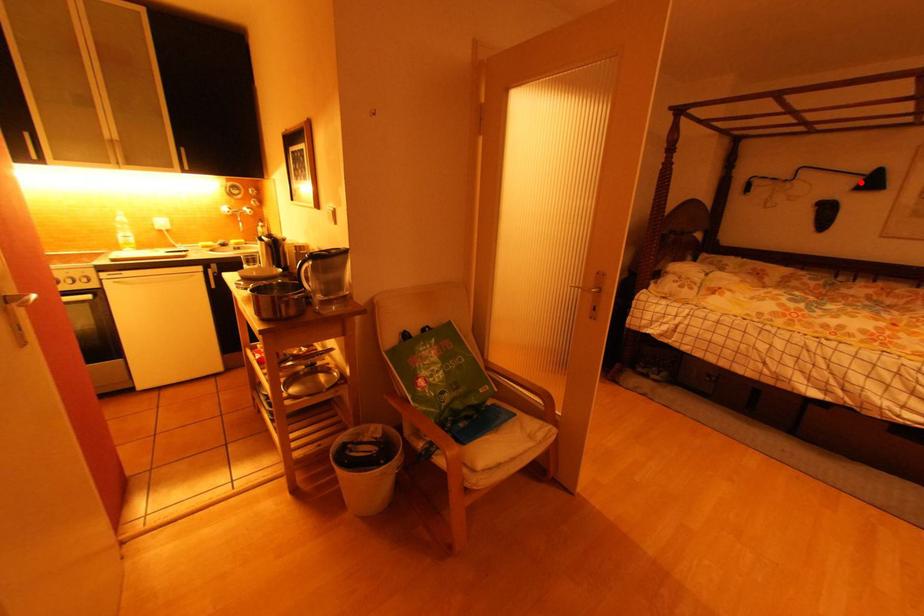
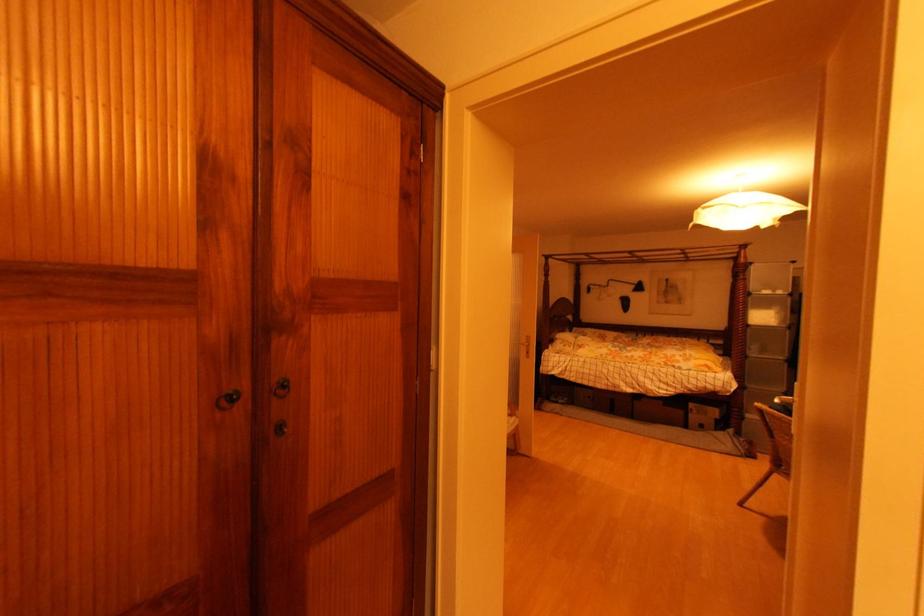
Question: I am providing you with two images of the same scene from different viewpoints. Given a red point in image1, look at the same physical point in image2. Is it:

Choices:
 (A) Closer to the viewpoint
 (B) Farther from the viewpoint

Answer: (A)